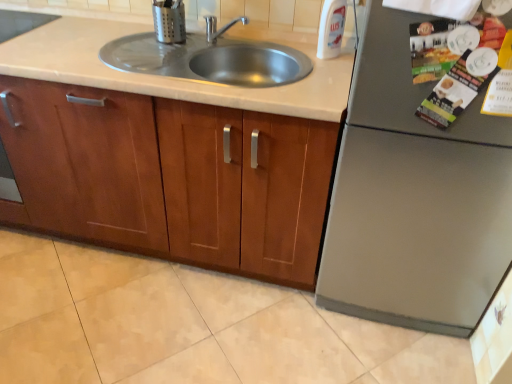
Question: Should I look upward or downward to see stainless steel sink at center?

Choices:
 (A) up
 (B) down

Answer: (A)

Question: Is matte plastic magazine at upper right to the left of beige tile floor at lower center from the viewer's perspective?

Choices:
 (A) no
 (B) yes

Answer: (A)

Question: From a real-world perspective, is matte plastic magazine at upper right on top of beige tile floor at lower center?

Choices:
 (A) no
 (B) yes

Answer: (B)

Question: Is matte plastic magazine at upper right aimed at beige tile floor at lower center?

Choices:
 (A) yes
 (B) no

Answer: (B)

Question: From the image's perspective, does matte plastic magazine at upper right appear lower than beige tile floor at lower center?

Choices:
 (A) no
 (B) yes

Answer: (A)

Question: From a real-world perspective, is matte plastic magazine at upper right positioned under beige tile floor at lower center based on gravity?

Choices:
 (A) no
 (B) yes

Answer: (A)

Question: Is matte plastic magazine at upper right looking in the opposite direction of beige tile floor at lower center?

Choices:
 (A) yes
 (B) no

Answer: (B)

Question: From a real-world perspective, is stainless steel sink at center below satin silver refrigerator at right, which ranks as the first appliance in front-to-back order?

Choices:
 (A) no
 (B) yes

Answer: (A)

Question: Is stainless steel sink at center directly adjacent to satin silver refrigerator at right, which ranks as the first appliance in front-to-back order?

Choices:
 (A) no
 (B) yes

Answer: (A)

Question: Is satin silver refrigerator at right, positioned as the first appliance in bottom-to-top order, at the back of stainless steel sink at center?

Choices:
 (A) yes
 (B) no

Answer: (B)

Question: From the image's perspective, is stainless steel sink at center over satin silver refrigerator at right, marked as the second appliance in a left-to-right arrangement?

Choices:
 (A) no
 (B) yes

Answer: (B)

Question: Can you confirm if stainless steel sink at center is shorter than satin silver refrigerator at right, the 2th appliance in the back-to-front sequence?

Choices:
 (A) yes
 (B) no

Answer: (A)

Question: Are stainless steel sink at center and satin silver refrigerator at right, positioned as the first appliance in bottom-to-top order, far apart?

Choices:
 (A) no
 (B) yes

Answer: (A)

Question: Is stainless steel sink at center positioned behind brushed metal utensil holder at upper center, which ranks as the 1th appliance in left-to-right order?

Choices:
 (A) yes
 (B) no

Answer: (B)